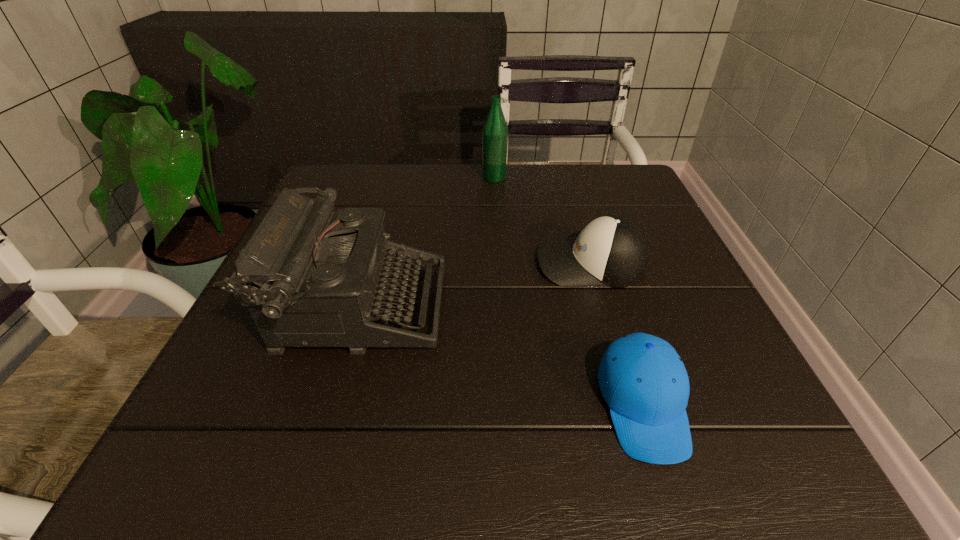
Find the location of a particular element. The image size is (960, 540). free space at the far right corner of the desktop is located at coordinates (621, 180).

Image resolution: width=960 pixels, height=540 pixels. I want to click on vacant area that lies between the farthest object and the farther cap, so click(x=542, y=221).

You are a GUI agent. You are given a task and a screenshot of the screen. Output one action in this format:
    pyautogui.click(x=<x>, y=<y>)
    Task: Click on the free point between the typewriter and the second object from left to right
    The width and height of the screenshot is (960, 540).
    Given the screenshot: What is the action you would take?
    pyautogui.click(x=427, y=242)

Locate an element on the screen. The width and height of the screenshot is (960, 540). free space between the taller cap and the shortest object is located at coordinates (617, 334).

The image size is (960, 540). Identify the location of vacant area that lies between the nearer cap and the third tallest object. (617, 334).

The width and height of the screenshot is (960, 540). In order to click on vacant area that lies between the nearer cap and the typewriter in this screenshot , I will do `click(501, 356)`.

The image size is (960, 540). In order to click on empty space between the farther cap and the leftmost object in this screenshot , I will do `click(475, 285)`.

Locate an element on the screen. The width and height of the screenshot is (960, 540). unoccupied area between the typewriter and the taller cap is located at coordinates (475, 285).

I want to click on unoccupied position between the farther cap and the bottle, so click(542, 221).

The image size is (960, 540). Find the location of `vacant area between the leftmost object and the third tallest object`. vacant area between the leftmost object and the third tallest object is located at coordinates (475, 285).